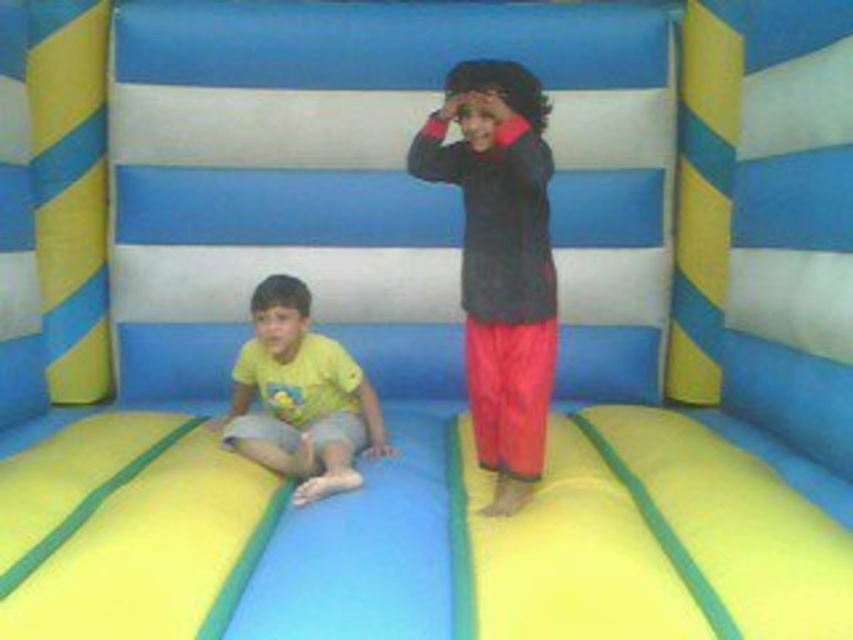
You are a parent looking for your child who is wearing a dark gray fleece jacket at center. According to the scene, where should you look to find them?

The dark gray fleece jacket at center is located at point (500, 260), so you should look at that position to find your child wearing the dark gray fleece jacket at center.

You are a photographer trying to capture both the dark gray fleece jacket at center and the yellow matte shirt at lower left in the same frame. Since the camera can only focus on objects with a certain thickness, which object should you prioritize to ensure it appears clearer in the photo?

The yellow matte shirt at lower left should be prioritized because it is thicker than the dark gray fleece jacket at center, making it easier to focus on.